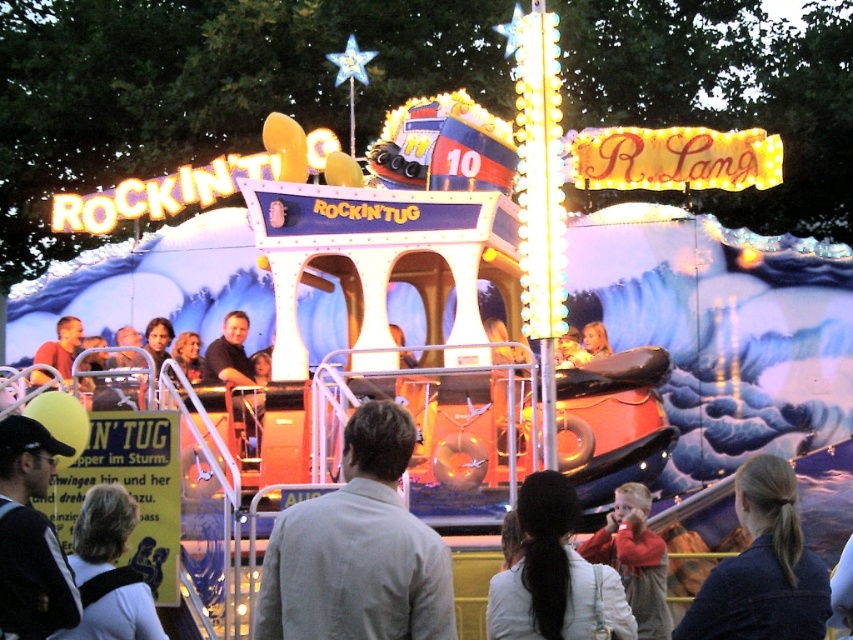
Is dark blue hair at lower right positioned before light brown hair at lower left?

Yes, it is.

Can you confirm if dark blue hair at lower right is positioned below light brown hair at lower left?

Correct, dark blue hair at lower right is located below light brown hair at lower left.

The image size is (853, 640). Find the location of `dark blue hair at lower right`. dark blue hair at lower right is located at coordinates (762, 566).

Can you confirm if gray cotton shirt at center is taller than matte brown shirt at center?

Yes, gray cotton shirt at center is taller than matte brown shirt at center.

Based on the photo, who is shorter, gray cotton shirt at center or matte brown shirt at center?

Standing shorter between the two is matte brown shirt at center.

Which is in front, point (309, 516) or point (74, 346)?

Point (309, 516) is more forward.

Identify the location of gray cotton shirt at center. The height and width of the screenshot is (640, 853). (358, 548).

Who is positioned more to the right, light brown hair at lower left or red fleece jacket at lower right?

From the viewer's perspective, red fleece jacket at lower right appears more on the right side.

Does point (122, 522) lie in front of point (627, 548)?

Yes, it is in front of point (627, 548).

Does point (79, 529) come behind point (614, 522)?

No, (79, 529) is in front of (614, 522).

Locate an element on the screen. The image size is (853, 640). light brown hair at lower left is located at coordinates (102, 531).